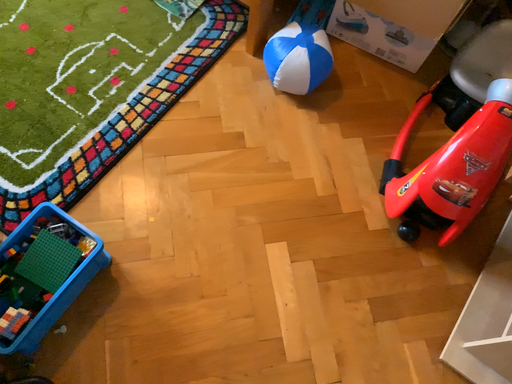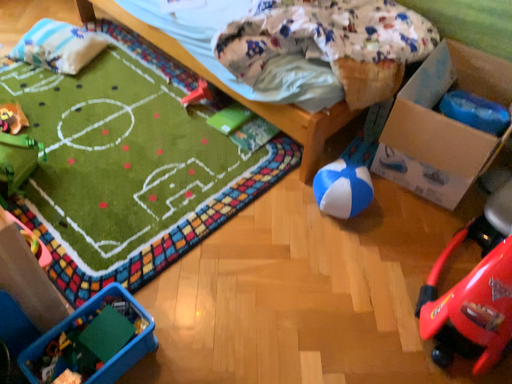
Question: Which way did the camera rotate in the video?

Choices:
 (A) rotated left
 (B) rotated right

Answer: (A)